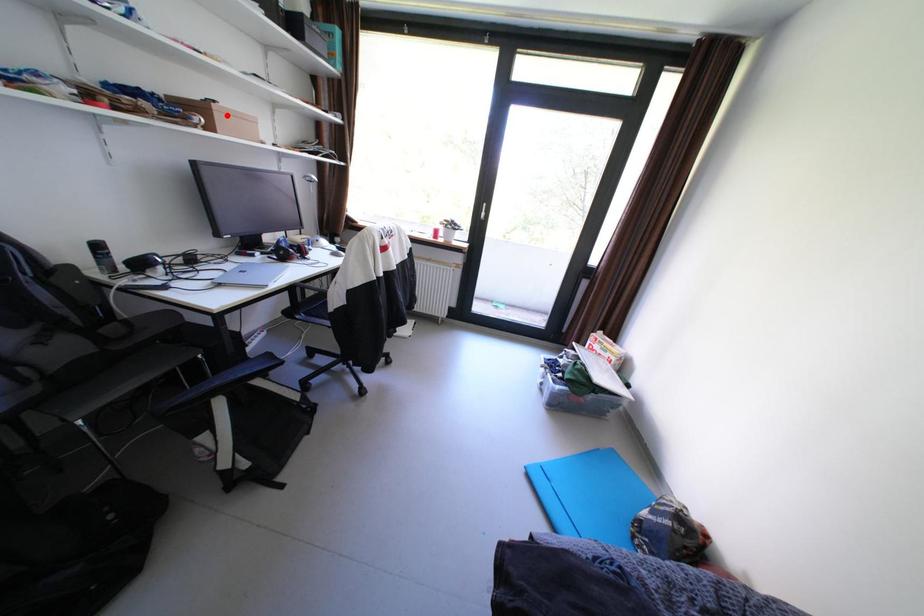
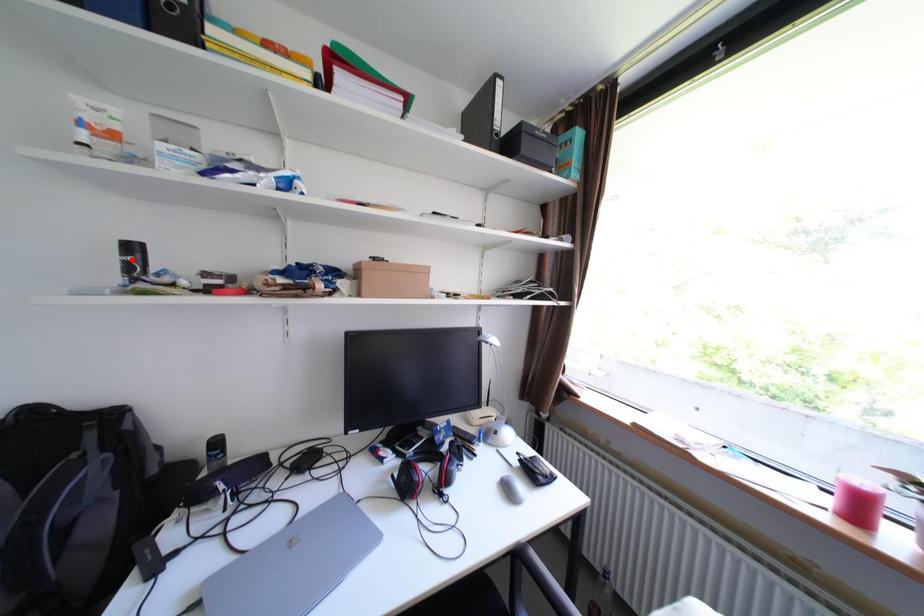
I am providing you with two images of the same scene from different viewpoints. A red point is marked on the first image and another point is marked on the second image. Do the highlighted points in image1 and image2 indicate the same real-world spot?

No